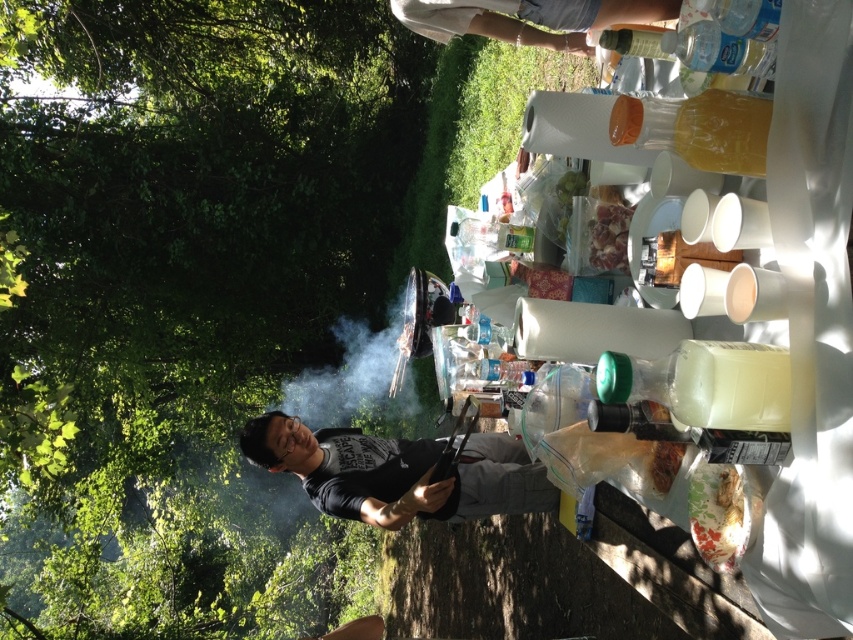
Question: Is green leafy tree at upper left smaller than clear plastic bottle at upper center?

Choices:
 (A) yes
 (B) no

Answer: (A)

Question: Is green leafy tree at upper left to the right of clear plastic bottle at upper center from the viewer's perspective?

Choices:
 (A) no
 (B) yes

Answer: (A)

Question: Which object is the farthest from the clear plastic bottle at upper center?

Choices:
 (A) black matte shirt at center
 (B) green leafy tree at upper left

Answer: (B)

Question: Is green leafy tree at upper left to the left of black matte shirt at center from the viewer's perspective?

Choices:
 (A) yes
 (B) no

Answer: (A)

Question: Which point is farther from the camera taking this photo?

Choices:
 (A) 490,20
 (B) 479,476

Answer: (B)

Question: Considering the real-world distances, which object is farthest from the clear plastic bottle at upper center?

Choices:
 (A) green leafy tree at upper left
 (B) black matte shirt at center

Answer: (A)